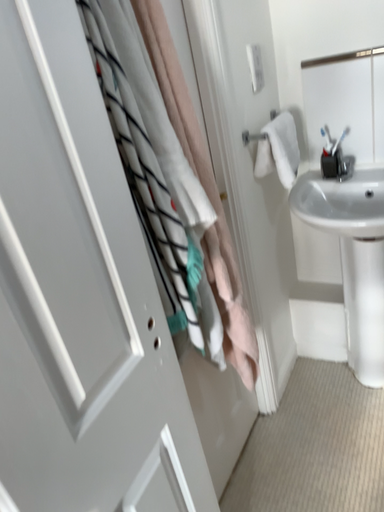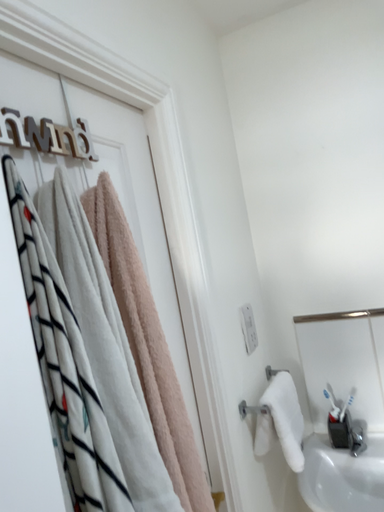
Question: Which way did the camera rotate in the video?

Choices:
 (A) rotated downward
 (B) rotated upward

Answer: (B)